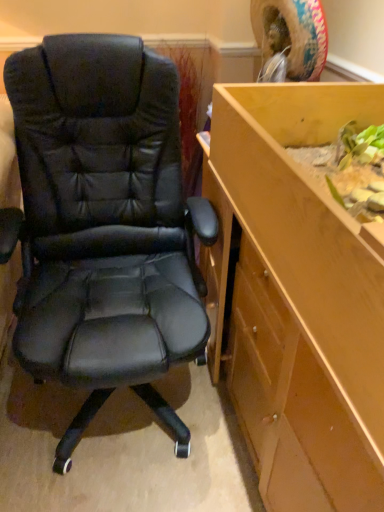
Where is `light brown wood cabinet at right`? The image size is (384, 512). light brown wood cabinet at right is located at coordinates (300, 297).

The height and width of the screenshot is (512, 384). Describe the element at coordinates (300, 297) in the screenshot. I see `light brown wood cabinet at right` at that location.

Consider the image. What is the approximate height of light brown wood cabinet at right?

light brown wood cabinet at right is 9.02 inches in height.

The image size is (384, 512). I want to click on light brown wood cabinet at right, so click(x=300, y=297).